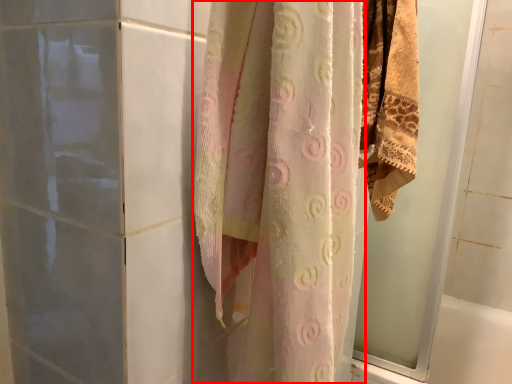
Question: Where is curtain (annotated by the red box) located in relation to screen door in the image?

Choices:
 (A) right
 (B) left

Answer: (B)